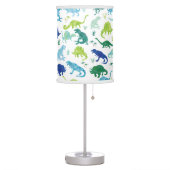
Image resolution: width=170 pixels, height=170 pixels. In order to click on lamp shade in this screenshot , I will do `click(89, 52)`.